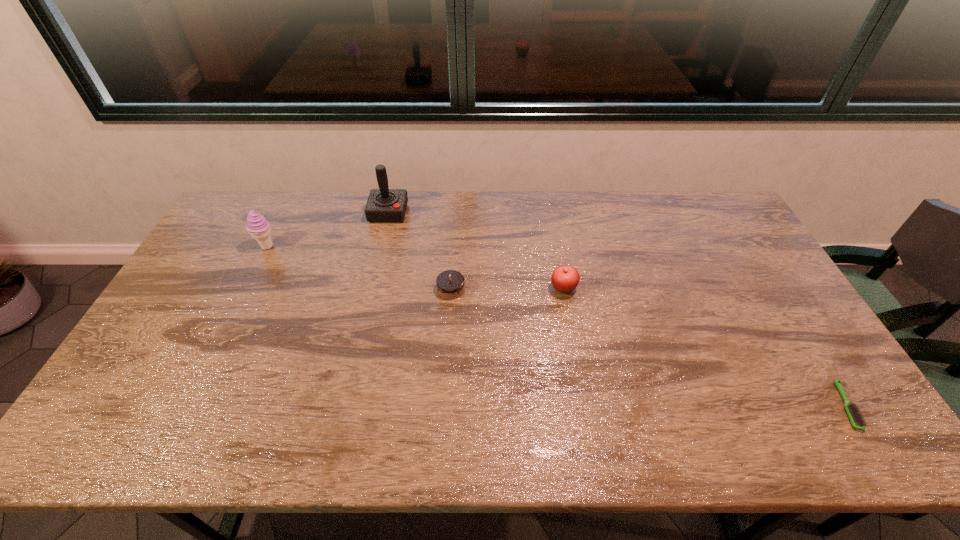
This screenshot has height=540, width=960. Identify the location of free location located 0.280m on the base of the joystick. tap(372, 281).

Identify the location of vacant space located 0.340m on the right of the leftmost object. The height and width of the screenshot is (540, 960). (380, 247).

The image size is (960, 540). I want to click on vacant space located on the front of the third tallest object, so click(x=582, y=392).

Image resolution: width=960 pixels, height=540 pixels. I want to click on vacant space located 0.400m on the front of the chocolate cake, so click(x=443, y=428).

The width and height of the screenshot is (960, 540). Find the location of `free space located 0.300m on the back of the shortest object`. free space located 0.300m on the back of the shortest object is located at coordinates tap(776, 294).

Where is `object that is positioned at the far edge`? This screenshot has width=960, height=540. object that is positioned at the far edge is located at coordinates (383, 205).

At what (x,y) coordinates should I click in order to perform the action: click on object located in the near edge section of the desktop. Please return your answer as a coordinate pair (x, y). The height and width of the screenshot is (540, 960). Looking at the image, I should click on (856, 419).

This screenshot has height=540, width=960. In order to click on object that is at the right edge in this screenshot , I will do `click(856, 419)`.

You are a GUI agent. You are given a task and a screenshot of the screen. Output one action in this format:
    pyautogui.click(x=<x>, y=<y>)
    Task: Click on the object positioned at the near right corner
    The width and height of the screenshot is (960, 540).
    Given the screenshot: What is the action you would take?
    pyautogui.click(x=856, y=419)

The image size is (960, 540). I want to click on free spot at the far edge of the desktop, so click(x=660, y=225).